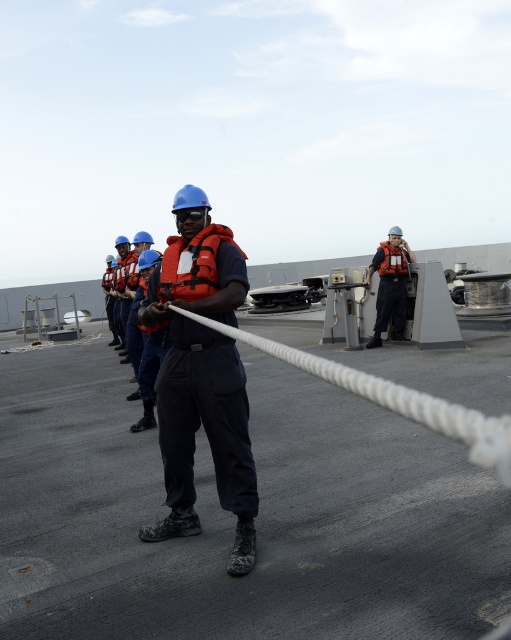
You are standing on the deck of the naval ship and want to move from the point at coordinates point (x=236, y=320) to the point at coordinates point (x=403, y=273). Which direction should you move in to get closer to the latter point?

You should move towards the direction of point (x=403, y=273), which is further away from the camera compared to point (x=236, y=320).

You are a sailor on the deck of a naval ship. You need to secure the white rope at center to a nearby anchor point. However, the anchor point is partially obstructed by the orange life vest at center. Can you easily access the anchor point to secure the rope?

The orange life vest at center is taller than the white rope at center, so the life vest may block your view or access to the anchor point, making it difficult to secure the rope easily.

Based on the scene description, which object is taller between the orange life vest at center and the orange matte safety vest at center?

The orange life vest at center is much taller than the orange matte safety vest at center.